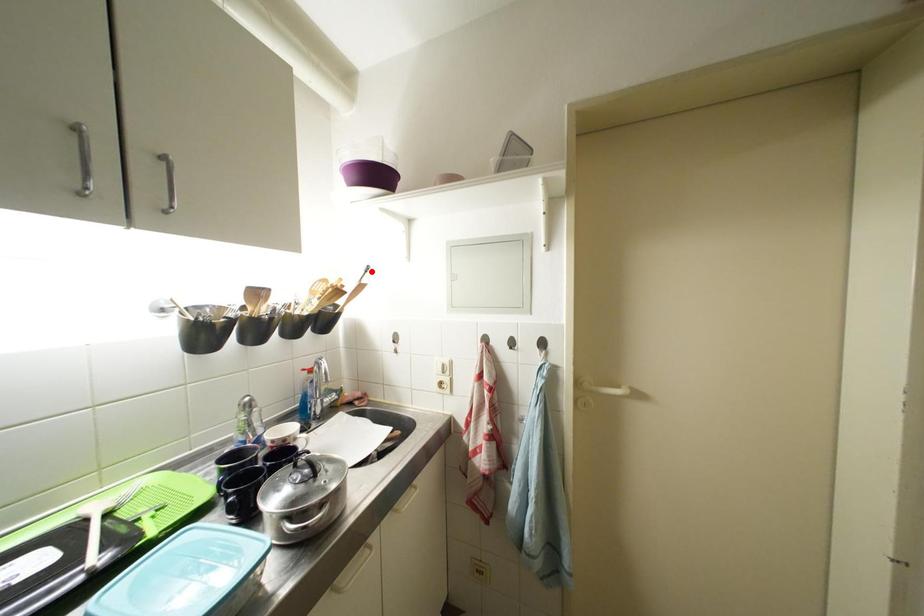
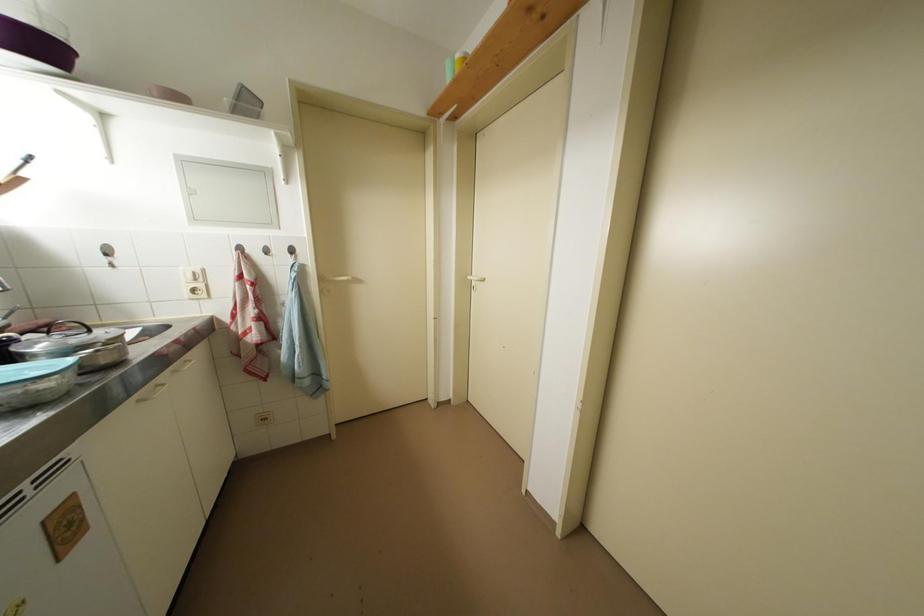
In the second image, find the point that corresponds to the highlighted location in the first image.

(30, 160)